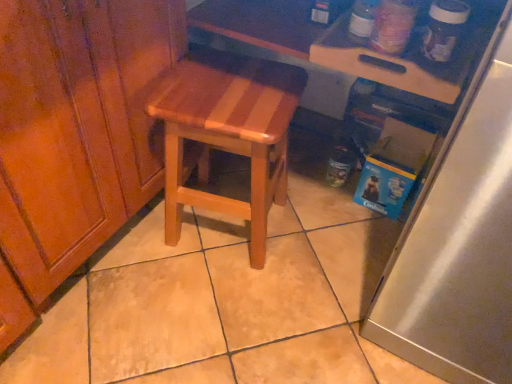
Where is `free space below wooden at center (from a real-world perspective)`? This screenshot has width=512, height=384. free space below wooden at center (from a real-world perspective) is located at coordinates (217, 228).